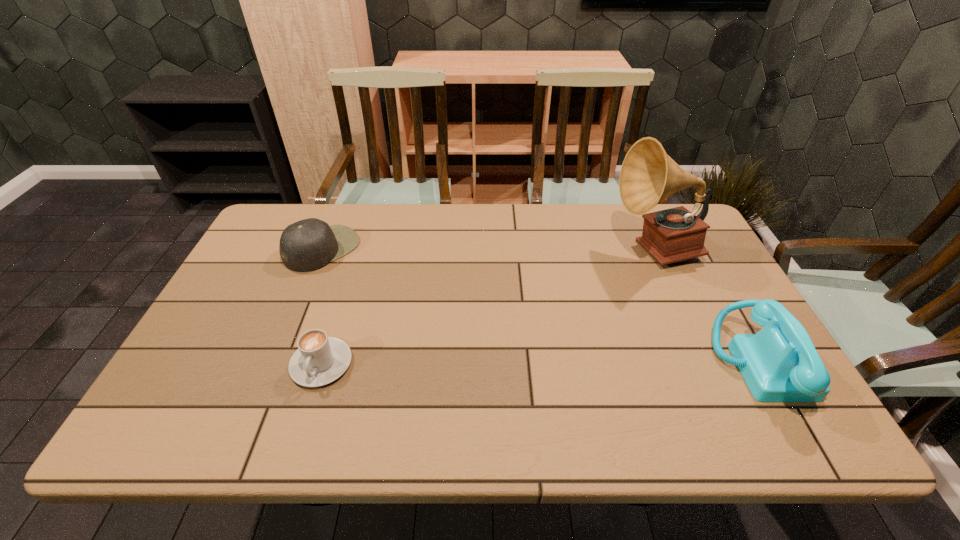
Where is `blank region between the tallest object and the third shortest object`? This screenshot has width=960, height=540. blank region between the tallest object and the third shortest object is located at coordinates (707, 307).

The height and width of the screenshot is (540, 960). I want to click on unoccupied position between the cappuccino and the phonograph record, so click(x=489, y=307).

The image size is (960, 540). What are the coordinates of `vacant area between the cappuccino and the tallest object` in the screenshot? It's located at (489, 307).

Identify the location of empty space that is in between the cap and the shortest object. (323, 306).

Choose which object is the second nearest neighbor to the third tallest object. Please provide its 2D coordinates. Your answer should be formatted as a tuple, i.e. [(x, y)], where the tuple contains the x and y coordinates of a point satisfying the conditions above.

[(648, 175)]

Identify the location of the closest object to the cap. (319, 360).

I want to click on blank space that satisfies the following two spatial constraints: 1. on the front side of the second tallest object; 2. on the dial of the tallest object, so click(706, 363).

Image resolution: width=960 pixels, height=540 pixels. In order to click on vacant point that satisfies the following two spatial constraints: 1. on the front side of the phonograph record; 2. on the dial of the telephone in this screenshot , I will do `click(706, 363)`.

Find the location of a particular element. The height and width of the screenshot is (540, 960). blank area in the image that satisfies the following two spatial constraints: 1. on the front side of the second shortest object; 2. on the dial of the telephone is located at coordinates (276, 363).

Image resolution: width=960 pixels, height=540 pixels. I want to click on vacant point that satisfies the following two spatial constraints: 1. on the front side of the second tallest object; 2. on the dial of the third tallest object, so click(x=276, y=363).